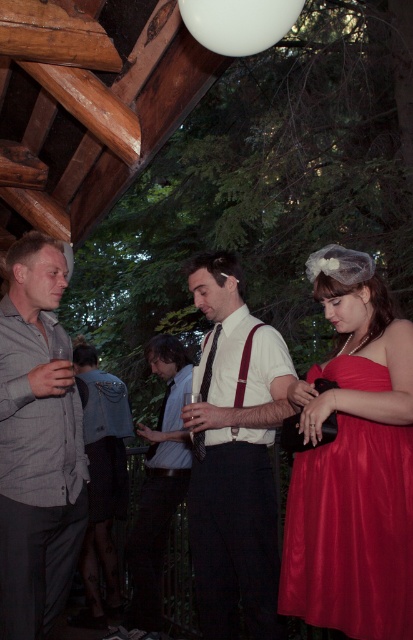
Based on the photo, you are a photographer at the event and need to capture a photo where both the matte red dress at center and the gray textured shirt at center are clearly visible. Given their positions, which one should you focus on first to ensure proper focus?

The matte red dress at center is below the gray textured shirt at center, so you should focus on the gray textured shirt at center first to ensure both are in focus as the dress is further away.